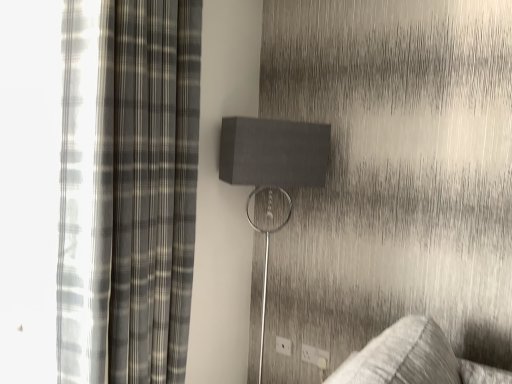
Question: Does point (329, 359) appear closer or farther from the camera than point (76, 339)?

Choices:
 (A) closer
 (B) farther

Answer: (B)

Question: Considering the relative positions of white plastic electric outlet at lower center, positioned as the 2th electric outlet in left-to-right order, and plaid fabric curtain at left in the image provided, is white plastic electric outlet at lower center, positioned as the 2th electric outlet in left-to-right order, to the left or to the right of plaid fabric curtain at left?

Choices:
 (A) right
 (B) left

Answer: (A)

Question: Estimate the real-world distances between objects in this image. Which object is closer to the white plastic electric outlet at lower right, placed as the third electric outlet when sorted from left to right?

Choices:
 (A) white plastic electric outlet at lower center, the second electric outlet viewed from the front
 (B) plaid fabric curtain at left
 (C) matte gray speaker at center
 (D) white plastic electric outlet at lower center, the 3th electric outlet from the right

Answer: (A)

Question: Which object is the farthest from the matte gray speaker at center?

Choices:
 (A) white plastic electric outlet at lower center, the 1th electric outlet when ordered from left to right
 (B) plaid fabric curtain at left
 (C) white plastic electric outlet at lower right, acting as the 3th electric outlet starting from the back
 (D) white plastic electric outlet at lower center, the second electric outlet viewed from the front

Answer: (C)